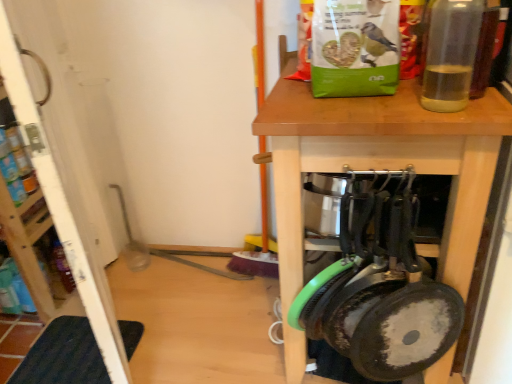
Question: Is transparent plastic bottle at upper right taller or shorter than wooden table at center?

Choices:
 (A) tall
 (B) short

Answer: (B)

Question: From the image's perspective, is transparent plastic bottle at upper right above or below wooden table at center?

Choices:
 (A) above
 (B) below

Answer: (A)

Question: Considering the real-world distances, which object is farthest from the wooden table at center?

Choices:
 (A) white wood screen door at left
 (B) dark blue rubber mat at lower left
 (C) transparent plastic bottle at upper right

Answer: (B)

Question: Which of these objects is positioned farthest from the dark blue rubber mat at lower left?

Choices:
 (A) wooden table at center
 (B) white wood screen door at left
 (C) transparent plastic bottle at upper right

Answer: (C)